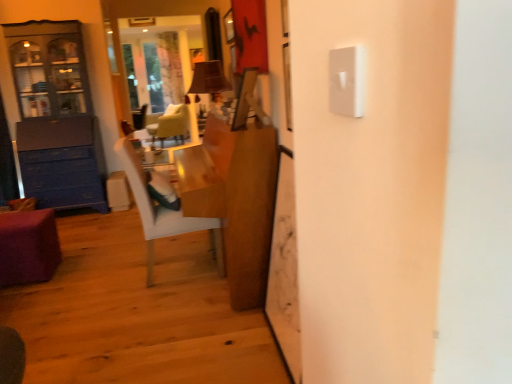
This screenshot has width=512, height=384. I want to click on vacant space situated on the left part of wooden desk at center, so click(86, 277).